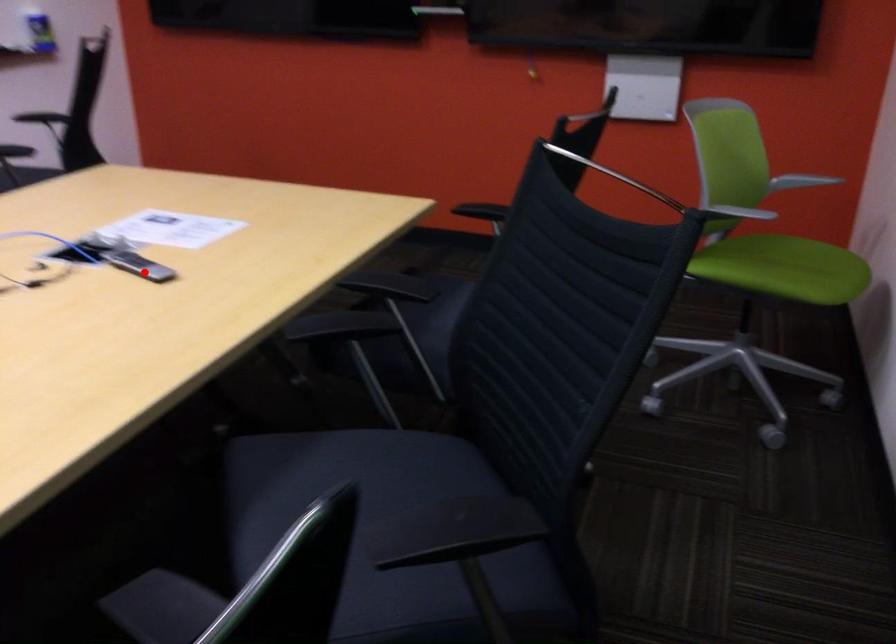
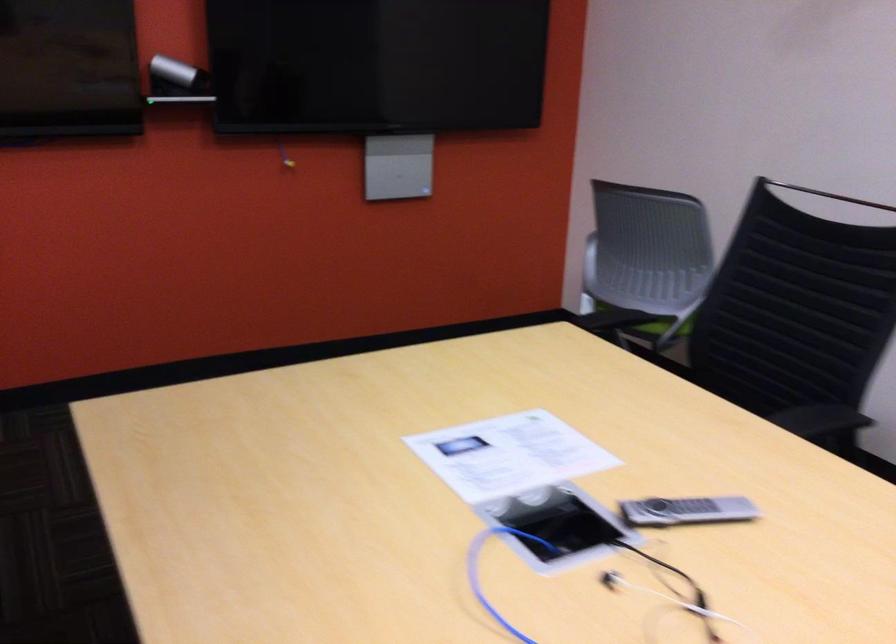
Question: A red point is marked in image1. In image2, is the corresponding 3D point closer to the camera or farther? Reply with the corresponding letter.

Choices:
 (A) The corresponding 3D point is closer.
 (B) The corresponding 3D point is farther.

Answer: (A)